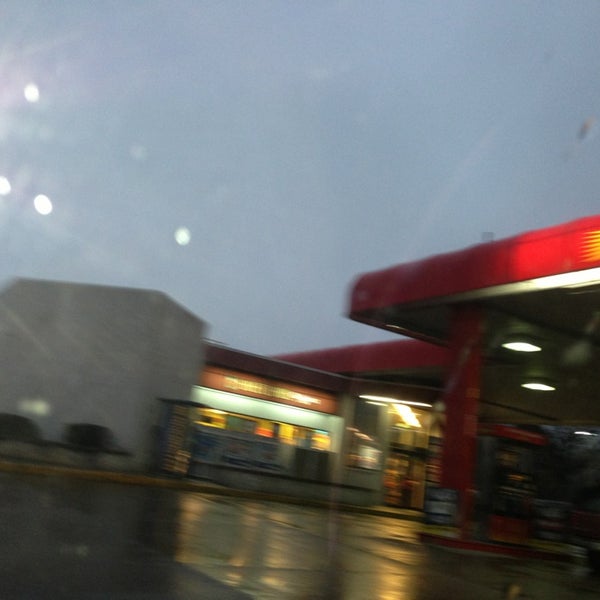
This screenshot has width=600, height=600. Find the location of `door`. door is located at coordinates (394, 486).